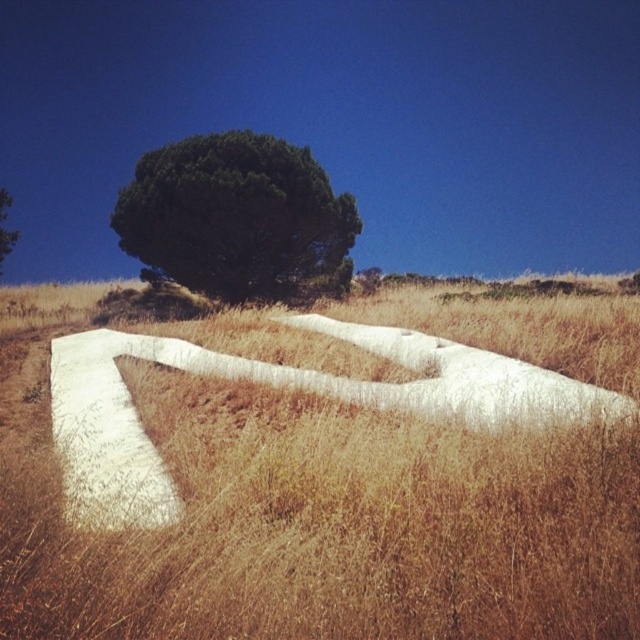
Question: Does green leafy tree at upper center come in front of green leafy tree at upper left?

Choices:
 (A) no
 (B) yes

Answer: (B)

Question: Considering the real-world distances, which object is farthest from the green leafy tree at upper center?

Choices:
 (A) dry grass at center
 (B) green leafy tree at upper left

Answer: (B)

Question: Considering the relative positions of dry grass at center and green leafy tree at upper left in the image provided, where is dry grass at center located with respect to green leafy tree at upper left?

Choices:
 (A) right
 (B) left

Answer: (A)

Question: Which of the following is the farthest from the observer?

Choices:
 (A) (1, 234)
 (B) (292, 205)

Answer: (A)

Question: Considering the relative positions of dry grass at center and green leafy tree at upper left in the image provided, where is dry grass at center located with respect to green leafy tree at upper left?

Choices:
 (A) right
 (B) left

Answer: (A)

Question: Which point is closer to the camera?

Choices:
 (A) green leafy tree at upper center
 (B) dry grass at center

Answer: (B)